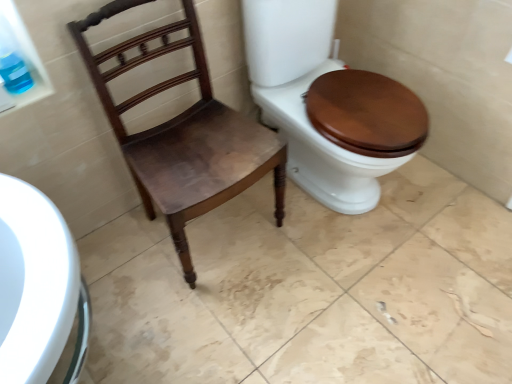
Question: In terms of size, does wooden toilet seat at right appear bigger or smaller than matte brown wood chair at center?

Choices:
 (A) small
 (B) big

Answer: (B)

Question: Would you say wooden toilet seat at right is to the left or to the right of matte brown wood chair at center in the picture?

Choices:
 (A) right
 (B) left

Answer: (A)

Question: From the image's perspective, is wooden toilet seat at right above or below matte brown wood chair at center?

Choices:
 (A) above
 (B) below

Answer: (A)

Question: Is point (132, 173) positioned closer to the camera than point (382, 115)?

Choices:
 (A) closer
 (B) farther

Answer: (B)

Question: From their relative heights in the image, would you say matte brown wood chair at center is taller or shorter than wooden toilet seat at right?

Choices:
 (A) short
 (B) tall

Answer: (A)

Question: Is matte brown wood chair at center wider or thinner than wooden toilet seat at right?

Choices:
 (A) wide
 (B) thin

Answer: (B)

Question: Would you say matte brown wood chair at center is inside or outside wooden toilet seat at right?

Choices:
 (A) outside
 (B) inside

Answer: (A)